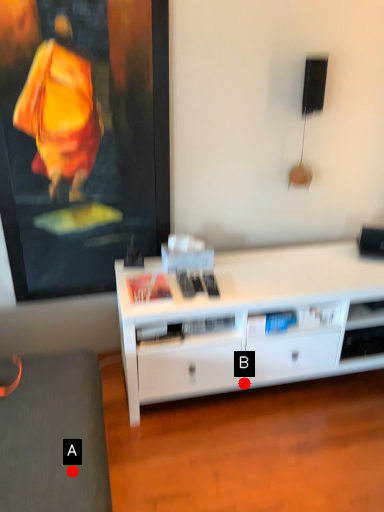
Question: Two points are circled on the image, labeled by A and B beside each circle. Which of the following is the farthest from the observer?

Choices:
 (A) A is further
 (B) B is further

Answer: (B)